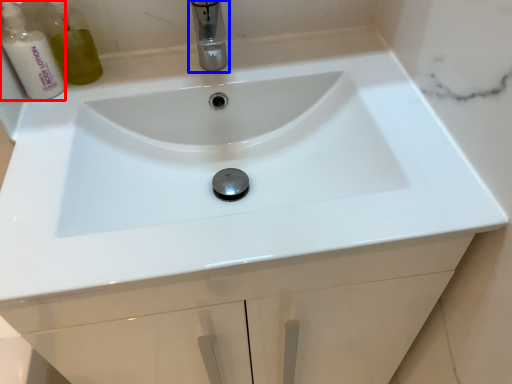
Question: Among these objects, which one is nearest to the camera, cleaning product (highlighted by a red box) or tap (highlighted by a blue box)?

Choices:
 (A) cleaning product
 (B) tap

Answer: (B)